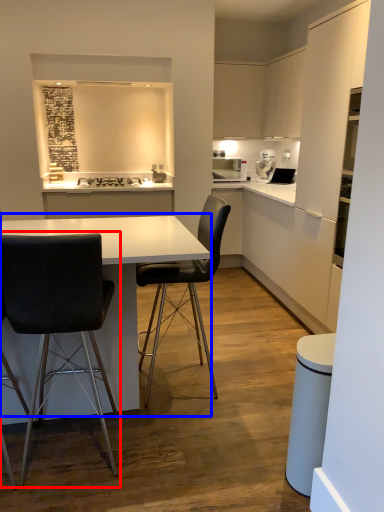
Question: Which point is further to the camera, chair (highlighted by a red box) or table (highlighted by a blue box)?

Choices:
 (A) chair
 (B) table

Answer: (B)